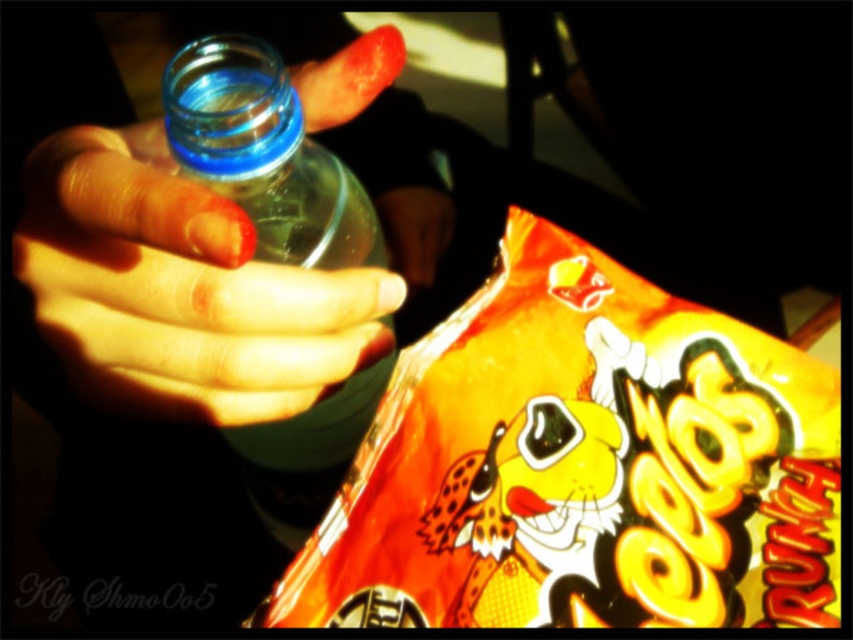
Looking at this image, you are organizing a picnic basket and need to stack items vertically. Given the height difference between the shiny orange snack at lower right and the transparent plastic bottle at left, which item should be placed at the bottom to ensure stability?

The transparent plastic bottle at left should be placed at the bottom because it is taller than the shiny orange snack at lower right, providing a stable base for stacking.

In the scene shown: You are an assistant analyzing the image. The scene shows a hand holding a bottle and a Cheetos bag in the foreground. Where is the translucent plastic hand at center positioned relative to the other objects?

The translucent plastic hand at center is located at point (178, 289) according to the coordinate system provided in the Objects Description.

You are organizing a picnic basket and see both the shiny orange snack at lower right and the transparent plastic bottle at left. Which item is positioned lower in the image?

The shiny orange snack at lower right is positioned lower than the transparent plastic bottle at left according to the description.